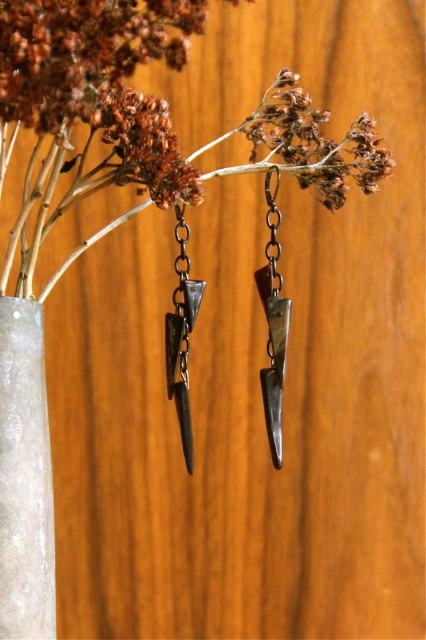
You are an interior designer arranging items on a shelf. You have a clear glass vase at left and a matte silver spike at center. The shelf is 12 inches wide. Can both items fit side by side without overlapping?

The clear glass vase at left is 7.51 inches from matte silver spike at center, so yes, both items can fit side by side on a 12 inch wide shelf since the distance between them is less than the shelf width.